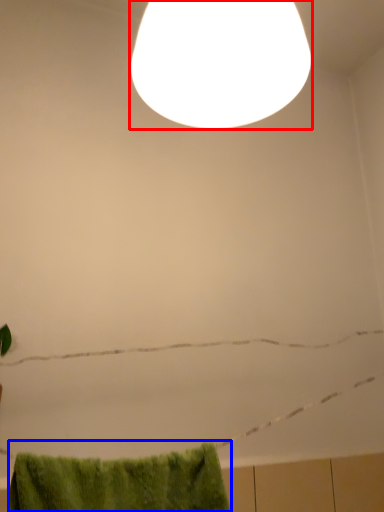
Question: Which object is further to the camera taking this photo, lamp (highlighted by a red box) or bath towel (highlighted by a blue box)?

Choices:
 (A) lamp
 (B) bath towel

Answer: (B)